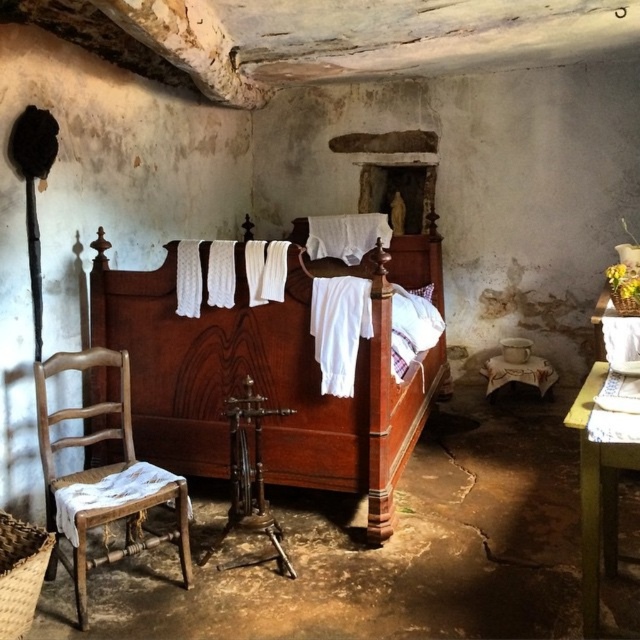
You are standing in the rustic bedroom and want to move from the worn wood chair at left to the polished wood bed at center. Which direction should you move in?

You should move to the right to reach the polished wood bed at center from the worn wood chair at left since the bed is positioned to the right of the chair.